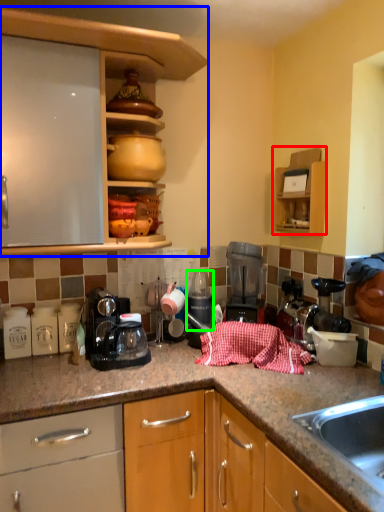
Question: Considering the real-world distances, which object is closest to cabinetry (highlighted by a red box)? cabinetry (highlighted by a blue box) or appliance (highlighted by a green box).

Choices:
 (A) cabinetry
 (B) appliance

Answer: (B)